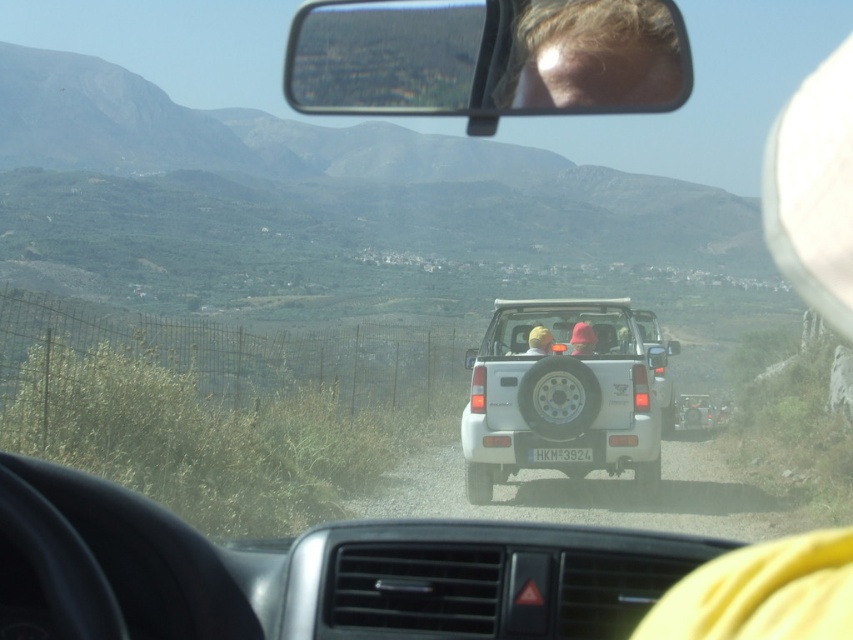
You are a passenger in the car and want to check both the clear plastic view mirror at upper center and the matte red helmet at rear center. Which object should you look to your left to see first?

The clear plastic view mirror at upper center is to the left of the matte red helmet at rear center, so you should look to your left to see the clear plastic view mirror at upper center first.